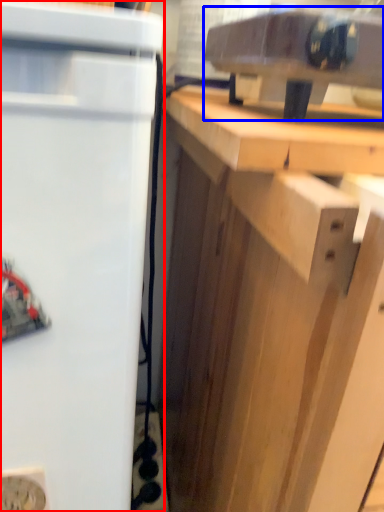
Question: Which object appears closest to the camera in this image, refrigerator (highlighted by a red box) or appliance (highlighted by a blue box)?

Choices:
 (A) refrigerator
 (B) appliance

Answer: (A)